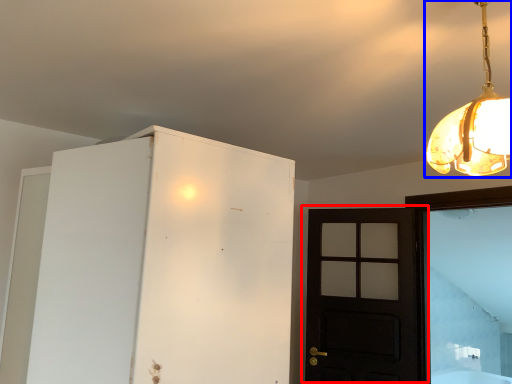
Question: Which object appears closest to the camera in this image, door (highlighted by a red box) or lamp (highlighted by a blue box)?

Choices:
 (A) door
 (B) lamp

Answer: (B)